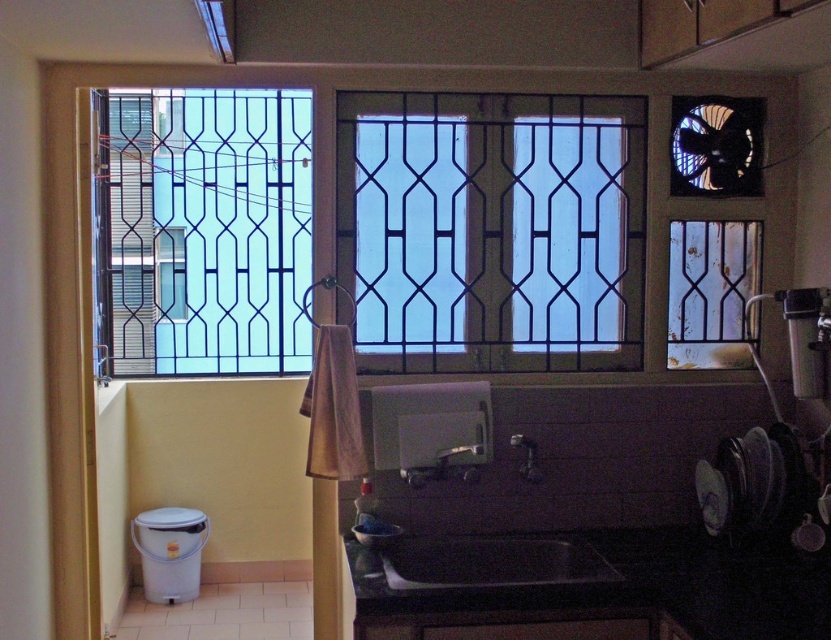
Can you confirm if satin nickel faucet at sink center is bigger than metallic silver faucet at center?

Indeed, satin nickel faucet at sink center has a larger size compared to metallic silver faucet at center.

Can you confirm if satin nickel faucet at sink center is smaller than metallic silver faucet at center?

No.

Is point (530, 460) farther from viewer compared to point (471, 454)?

Yes, it is behind point (471, 454).

I want to click on satin nickel faucet at sink center, so click(x=527, y=456).

Which of these two, black matte counter top at lower center or black matte sink at lower center, stands taller?

black matte counter top at lower center is taller.

Can you confirm if black matte counter top at lower center is positioned below black matte sink at lower center?

Yes, black matte counter top at lower center is below black matte sink at lower center.

This screenshot has height=640, width=831. In order to click on black matte counter top at lower center in this screenshot , I will do `click(588, 588)`.

The image size is (831, 640). What are the coordinates of `black matte counter top at lower center` in the screenshot? It's located at (588, 588).

Which of these two, clear glass window at center or black matte sink at lower center, stands shorter?

With less height is black matte sink at lower center.

Who is taller, clear glass window at center or black matte sink at lower center?

clear glass window at center

Does point (458, 275) come farther from viewer compared to point (493, 576)?

Yes, point (458, 275) is farther from viewer.

Identify the location of clear glass window at center. (492, 228).